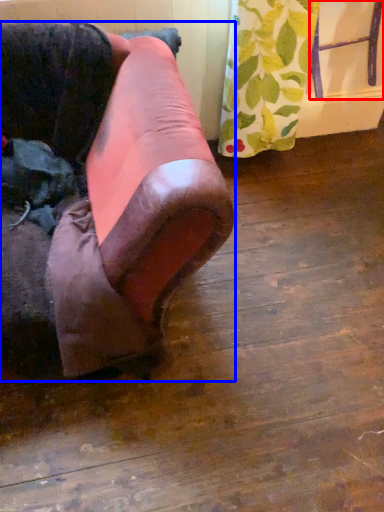
Question: Which point is closer to the camera, furniture (highlighted by a red box) or furniture (highlighted by a blue box)?

Choices:
 (A) furniture
 (B) furniture

Answer: (B)